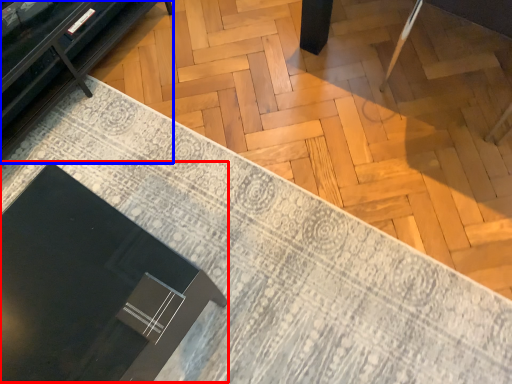
Question: Which of the following is the farthest to the observer, round table (highlighted by a red box) or furniture (highlighted by a blue box)?

Choices:
 (A) round table
 (B) furniture

Answer: (B)